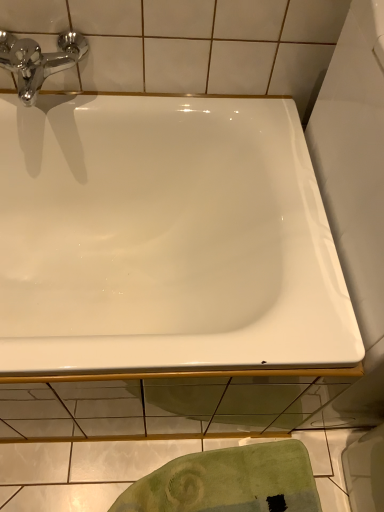
Question: Is white glossy bathtub at center in front of green textured towel at lower center?

Choices:
 (A) no
 (B) yes

Answer: (B)

Question: From a real-world perspective, does white glossy bathtub at center sit lower than green textured towel at lower center?

Choices:
 (A) yes
 (B) no

Answer: (B)

Question: Considering the relative sizes of white glossy bathtub at center and green textured towel at lower center in the image provided, is white glossy bathtub at center thinner than green textured towel at lower center?

Choices:
 (A) yes
 (B) no

Answer: (B)

Question: Is white glossy bathtub at center directly adjacent to green textured towel at lower center?

Choices:
 (A) yes
 (B) no

Answer: (B)

Question: Is white glossy bathtub at center turned away from green textured towel at lower center?

Choices:
 (A) no
 (B) yes

Answer: (A)

Question: Can you confirm if white glossy bathtub at center is positioned to the right of green textured towel at lower center?

Choices:
 (A) no
 (B) yes

Answer: (A)

Question: Considering the relative sizes of chrome/metallic faucet at upper left and green textured towel at lower center in the image provided, is chrome/metallic faucet at upper left taller than green textured towel at lower center?

Choices:
 (A) no
 (B) yes

Answer: (B)

Question: Is chrome/metallic faucet at upper left closer to the viewer compared to green textured towel at lower center?

Choices:
 (A) yes
 (B) no

Answer: (A)

Question: Can you confirm if chrome/metallic faucet at upper left is shorter than green textured towel at lower center?

Choices:
 (A) yes
 (B) no

Answer: (B)

Question: From a real-world perspective, is chrome/metallic faucet at upper left on top of green textured towel at lower center?

Choices:
 (A) no
 (B) yes

Answer: (B)

Question: Is the depth of chrome/metallic faucet at upper left greater than that of green textured towel at lower center?

Choices:
 (A) yes
 (B) no

Answer: (B)

Question: Does chrome/metallic faucet at upper left have a larger size compared to green textured towel at lower center?

Choices:
 (A) yes
 (B) no

Answer: (B)

Question: Can you confirm if green textured towel at lower center is taller than white glossy bathtub at center?

Choices:
 (A) yes
 (B) no

Answer: (B)